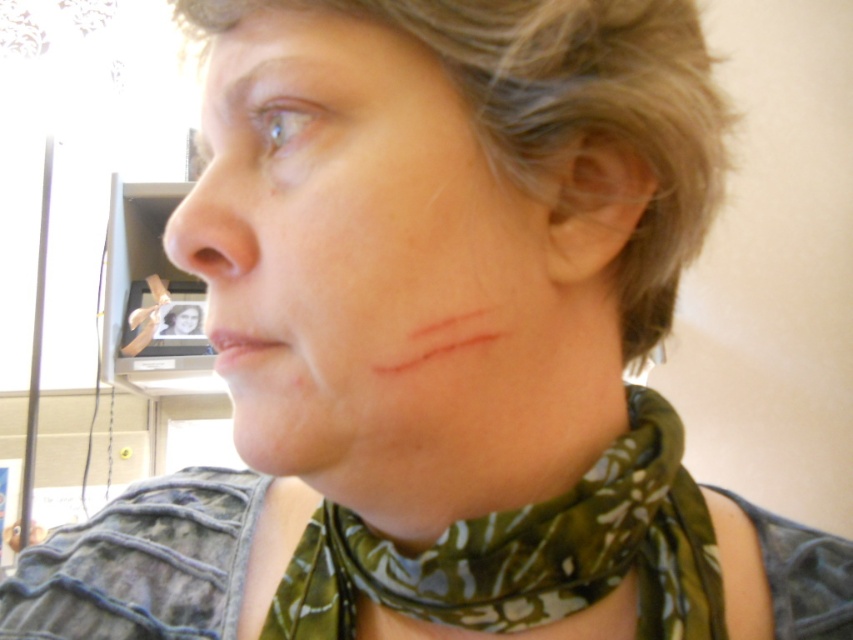
Looking at the person in the image, which object is larger between the skin at center and the matte skin nose at center?

The matte skin nose at center is larger than the skin at center.

You are an artist sketching this person. You need to decide which object is closer to you between the green printed fabric scarf at lower center and the matte skin nose at center. Which one should you focus on first?

The green printed fabric scarf at lower center is closer to you than the matte skin nose at center, so you should focus on the green printed fabric scarf at lower center first.